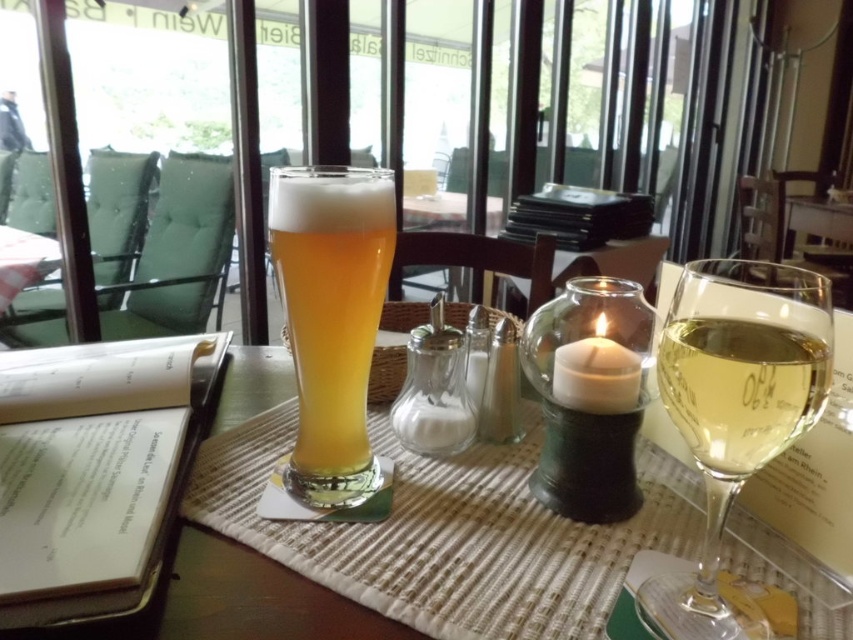
You are a server at the restaurant and need to place a new menu on the table. The menu is 15 cm wide. You have two options for placement next to the existing items on the right side of the table. The transparent glass at right and the translucent glass wine at right are both there. Which glass should you place the menu next to if you want to ensure there is enough space?

The transparent glass at right is wider than the translucent glass wine at right, so placing the menu next to the translucent glass wine at right would leave more space for the menu.

You are a server at a restaurant and need to place a new drink order on the table. The order includes a sparkling water and a red wine. The table currently has a transparent glass at right and a translucent glass wine at right. According to the scene description, where should you place the new drinks to avoid confusion with the existing ones?

The transparent glass at right is positioned under the translucent glass wine at right. To avoid confusion, place the sparkling water in a new transparent glass and the red wine in a new translucent glass on the table, ensuring they are placed in different positions than the existing ones.